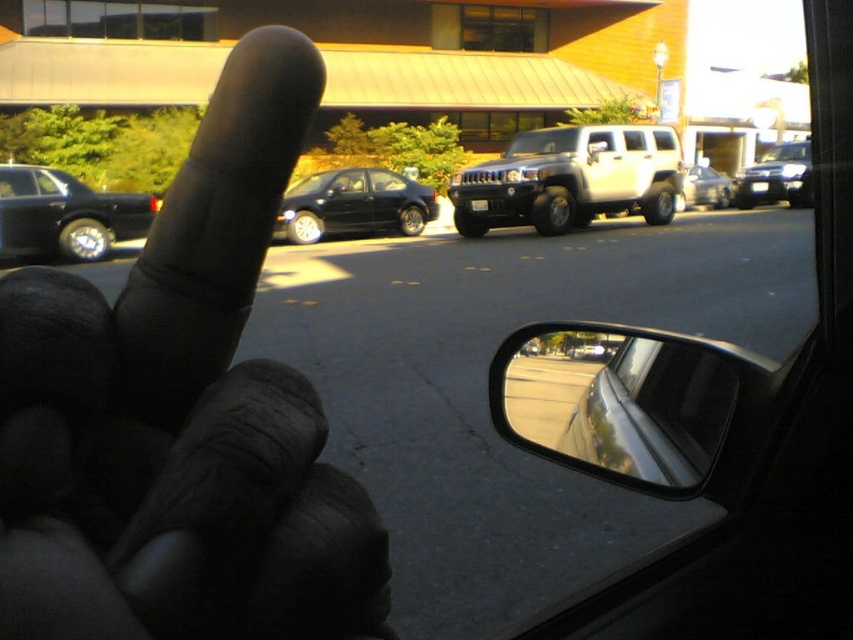
Question: Is glossy metallic side mirror at lower right above metallic silver suv at upper right?

Choices:
 (A) yes
 (B) no

Answer: (B)

Question: Does shiny black sedan at left have a greater width compared to metallic silver suv at upper right?

Choices:
 (A) no
 (B) yes

Answer: (A)

Question: Which point appears farthest from the camera in this image?

Choices:
 (A) (524, 428)
 (B) (247, 282)
 (C) (656, 145)
 (D) (276, 224)

Answer: (C)

Question: Among these objects, which one is farthest from the camera?

Choices:
 (A) black matte finger at upper left
 (B) matte black sedan at center
 (C) shiny black sedan at left
 (D) white matte suv at center

Answer: (B)

Question: Is the position of white matte suv at center more distant than that of metallic silver suv at upper right?

Choices:
 (A) no
 (B) yes

Answer: (A)

Question: Among these objects, which one is nearest to the camera?

Choices:
 (A) glossy metallic side mirror at lower right
 (B) clear glass window at center
 (C) matte black sedan at center

Answer: (A)